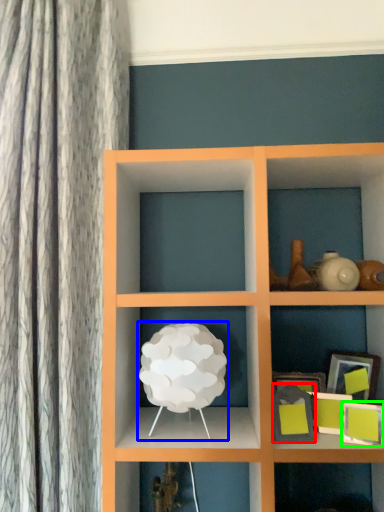
Question: Which object is the closest to the picture frame (highlighted by a red box)? Choose among these: table lamp (highlighted by a blue box) or picture frame (highlighted by a green box).

Choices:
 (A) table lamp
 (B) picture frame

Answer: (B)